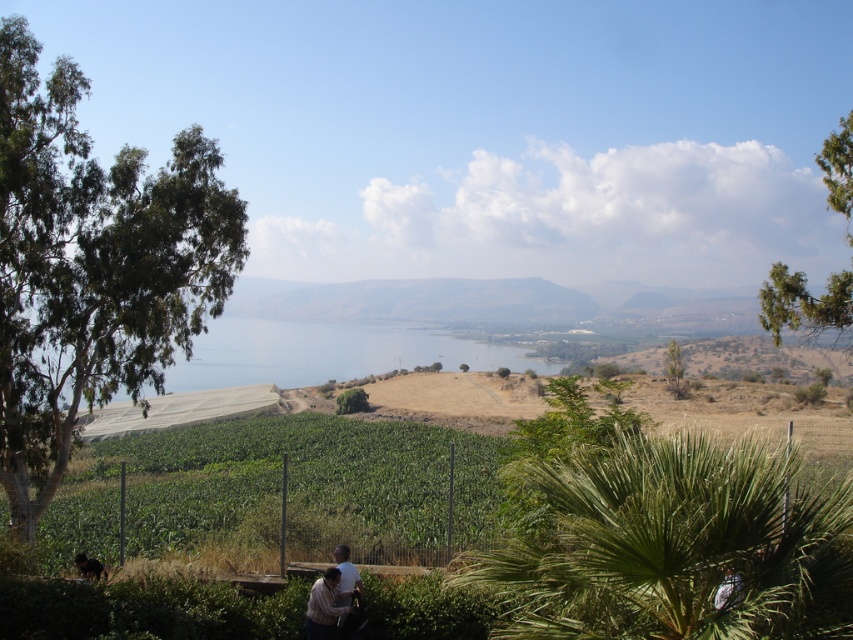
This screenshot has width=853, height=640. What do you see at coordinates (91, 268) in the screenshot?
I see `green leafy tree at left` at bounding box center [91, 268].

Is point (20, 284) farther from viewer compared to point (850, 129)?

No, it is in front of (850, 129).

Which is in front, point (16, 321) or point (843, 211)?

Positioned in front is point (16, 321).

I want to click on green leafy tree at left, so click(x=91, y=268).

At what (x,y) coordinates should I click in order to perform the action: click on dark brown leather jacket at lower center. Please return your answer as a coordinate pair (x, y). Image resolution: width=853 pixels, height=640 pixels. Looking at the image, I should click on (332, 596).

Between dark brown leather jacket at lower center and green leafy tree at center-right, which one has less height?

Standing shorter between the two is dark brown leather jacket at lower center.

This screenshot has height=640, width=853. Identify the location of dark brown leather jacket at lower center. [332, 596].

Where is `dark brown leather jacket at lower center`? This screenshot has height=640, width=853. dark brown leather jacket at lower center is located at coordinates (332, 596).

Who is higher up, green leafy tree at center-right or green leafy tree at center?

green leafy tree at center-right is higher up.

Is green leafy tree at center-right to the right of green leafy tree at center from the viewer's perspective?

Correct, you'll find green leafy tree at center-right to the right of green leafy tree at center.

Does point (674, 356) come behind point (363, 392)?

That is True.

The height and width of the screenshot is (640, 853). Find the location of `green leafy tree at center-right`. green leafy tree at center-right is located at coordinates (674, 368).